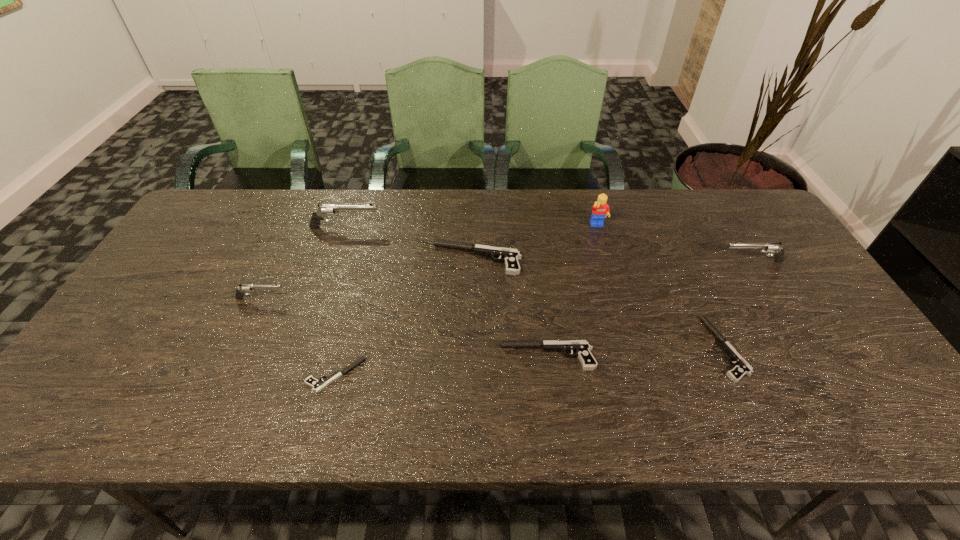
The width and height of the screenshot is (960, 540). I want to click on the third shortest object, so 581,347.

Find the location of a particular element. The height and width of the screenshot is (540, 960). the fifth tallest pistol is located at coordinates (581, 347).

The width and height of the screenshot is (960, 540). What are the coordinates of `the sixth pistol from left to right` in the screenshot? It's located at (741, 367).

I want to click on the seventh object from left to right, so click(741, 367).

This screenshot has width=960, height=540. Find the location of `the shortest pistol`. the shortest pistol is located at coordinates (317, 386).

Locate an element on the screen. This screenshot has width=960, height=540. the smallest black pistol is located at coordinates (317, 386).

You are a GUI agent. You are given a task and a screenshot of the screen. Output one action in this format:
    pyautogui.click(x=<x>, y=<y>)
    Task: Click on the free location located on the face of the tallest object
    Image resolution: width=960 pixels, height=540 pixels.
    Given the screenshot: What is the action you would take?
    pyautogui.click(x=603, y=244)

Image resolution: width=960 pixels, height=540 pixels. Find the location of `free space located 0.270m on the front-facing side of the second tallest object`. free space located 0.270m on the front-facing side of the second tallest object is located at coordinates (467, 227).

This screenshot has height=540, width=960. I want to click on vacant space situated on the front-facing side of the third tallest object, so click(x=694, y=261).

You are a GUI agent. You are given a task and a screenshot of the screen. Output one action in this format:
    pyautogui.click(x=<x>, y=<y>)
    Task: Click on the free space located on the front-facing side of the third tallest object
    Image resolution: width=960 pixels, height=540 pixels.
    Given the screenshot: What is the action you would take?
    pos(663,261)